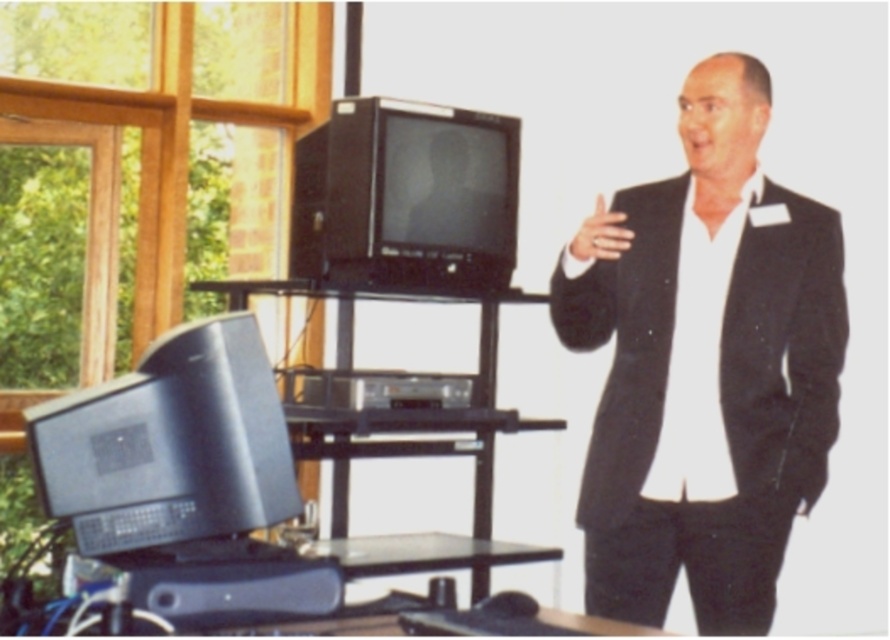
At what (x,y) coordinates should I click in order to perform the action: click on black matte suit at right. Please return your answer as a coordinate pair (x, y). Looking at the image, I should click on (704, 365).

Who is taller, black matte suit at right or black plastic television at upper center?

black matte suit at right is taller.

Does point (628, 600) come behind point (508, 262)?

No, it is in front of (508, 262).

Is point (740, 188) positioned before point (350, 259)?

Yes.

This screenshot has width=890, height=640. What are the coordinates of `black matte suit at right` in the screenshot? It's located at (704, 365).

Does black plastic television at upper center have a larger size compared to silvery metallic monitor at center?

Yes.

Is point (480, 179) positioned after point (435, 198)?

Yes.

Is point (503, 280) positioned behind point (460, 198)?

That is True.

The height and width of the screenshot is (640, 890). What are the coordinates of `black plastic television at upper center` in the screenshot? It's located at (406, 196).